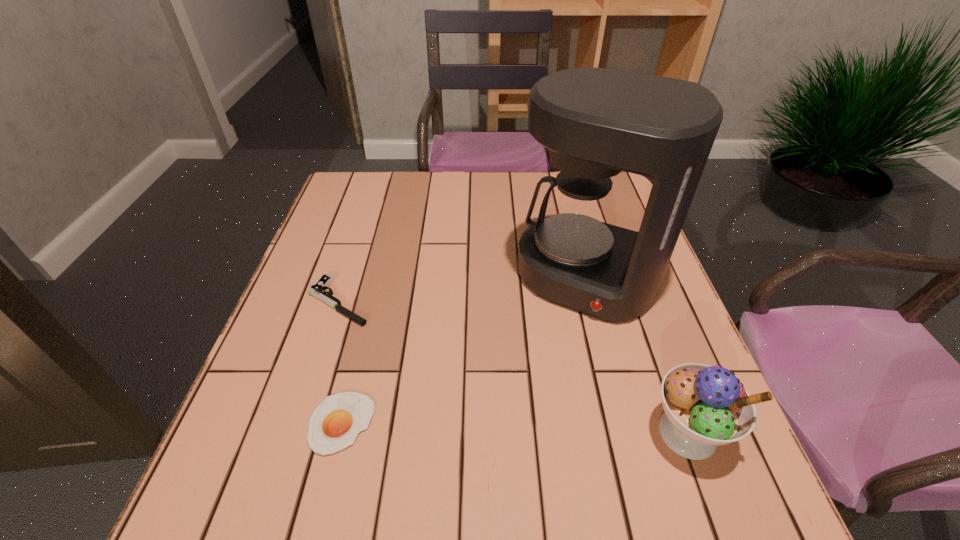
Where is `empty space that is in between the pistol and the icecream`? This screenshot has height=540, width=960. empty space that is in between the pistol and the icecream is located at coordinates (513, 367).

What are the coordinates of `free space between the pistol and the egg yolk` in the screenshot? It's located at (340, 362).

Find the location of a particular element. The image size is (960, 540). blank region between the third shortest object and the egg yolk is located at coordinates (515, 428).

The image size is (960, 540). What are the coordinates of `blank region between the tallest object and the shortest object` in the screenshot? It's located at (464, 350).

Identify which object is the third nearest to the icecream. Please provide its 2D coordinates. Your answer should be formatted as a tuple, i.e. [(x, y)], where the tuple contains the x and y coordinates of a point satisfying the conditions above.

[(319, 290)]

Select which object appears as the second closest to the pistol. Please provide its 2D coordinates. Your answer should be formatted as a tuple, i.e. [(x, y)], where the tuple contains the x and y coordinates of a point satisfying the conditions above.

[(595, 122)]

Identify the location of free location that satisfies the following two spatial constraints: 1. on the front side of the pistol; 2. on the left side of the shortest object. (300, 423).

This screenshot has width=960, height=540. In order to click on vacant region that satisfies the following two spatial constraints: 1. on the front side of the tallest object; 2. on the right side of the icecream in this screenshot , I will do click(627, 433).